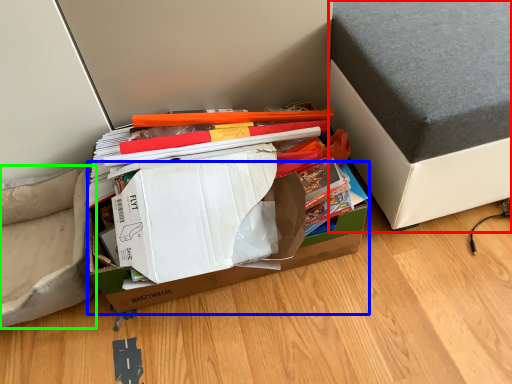
Question: Which object is positioned closest to furniture (highlighted by a red box)? Select from cardboard box (highlighted by a blue box) and armchair (highlighted by a green box).

Choices:
 (A) cardboard box
 (B) armchair

Answer: (A)